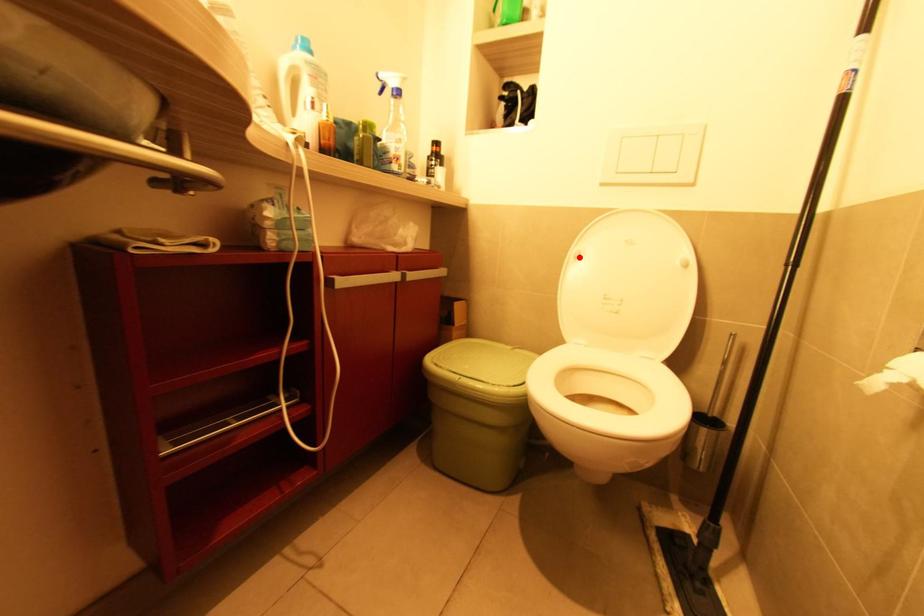
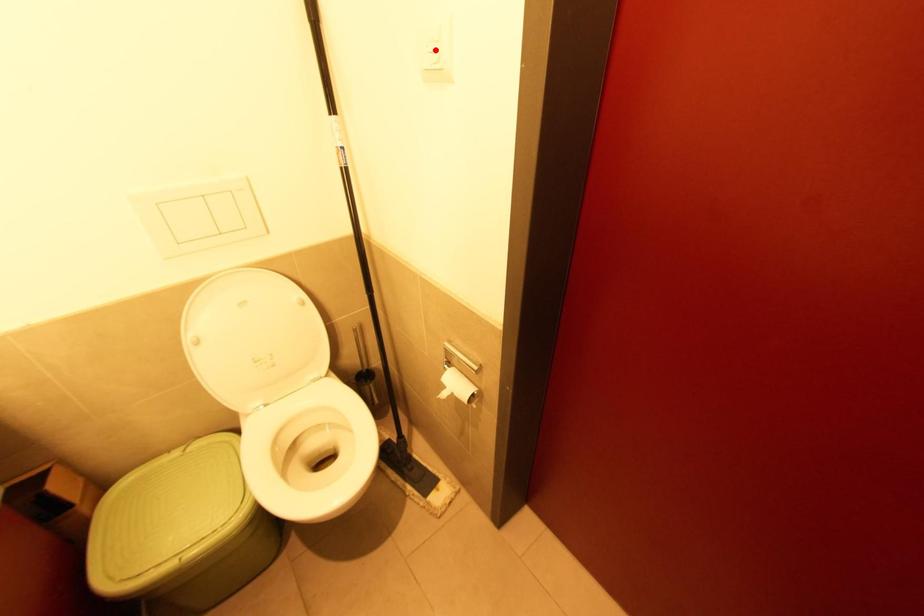
I am providing you with two images of the same scene from different viewpoints. A red point is marked on the first image and another point is marked on the second image. Do the highlighted points in image1 and image2 indicate the same real-world spot?

No